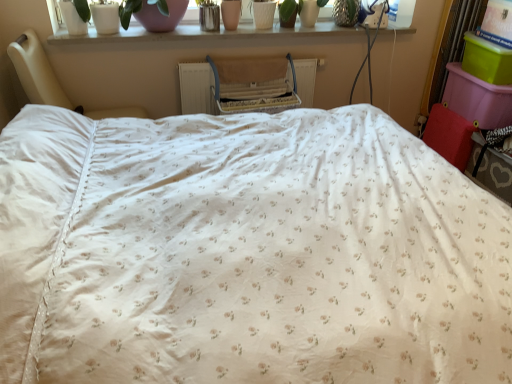
You are a GUI agent. You are given a task and a screenshot of the screen. Output one action in this format:
    pyautogui.click(x=<x>, y=<y>)
    Task: Click on the free space above white plastic radiator at center (from a real-world perspective)
    
    Given the screenshot: What is the action you would take?
    pyautogui.click(x=253, y=58)